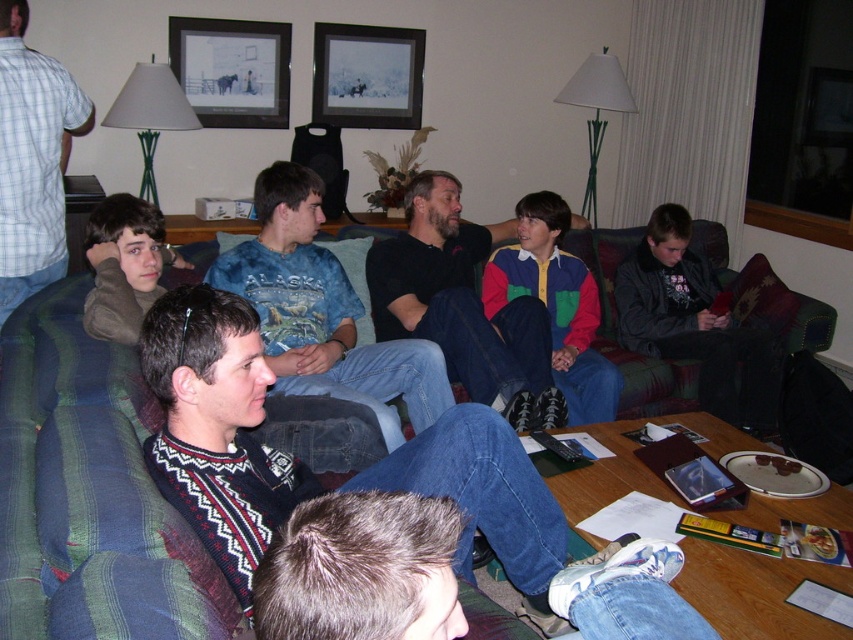
You are a guest at this gathering and want to place a small decorative item on the couch between the black cotton shirt at center and the metallic silver picture frame at upper center. Which object should you place it closer to to ensure it doesn

The black cotton shirt at center is bigger than the metallic silver picture frame at upper center, so placing the decorative item closer to the metallic silver picture frame at upper center would ensure it is nearer to the smaller object.

You are standing in the living room and want to take a photo of the two points mentioned. Which point, point (x=440, y=332) or point (x=258, y=84), is closer to you?

Point (x=440, y=332) is closer to you than point (x=258, y=84).